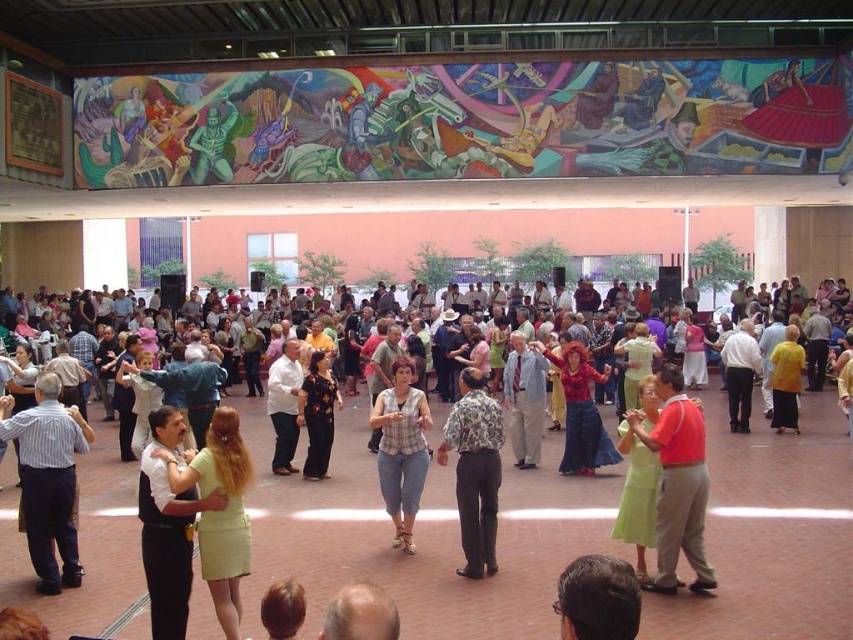
You are standing at the entrance of the venue and see the point marked at coordinates (167, 525). What object is located at that point?

The point at coordinates (167, 525) corresponds to the light green dress at center.

You are standing at the entrance of the venue and want to find the floral dress at center. According to the coordinates provided, in which direction should you look to locate it?

The floral dress at center is located at coordinates point (422, 536). Since the coordinate system typically has (0, 0) at the bottom left corner, the x value of 0.839 indicates it is towards the right side, and the y value of 0.496 places it near the center vertically. Therefore, you should look towards the right side of the venue to find the floral dress at center.